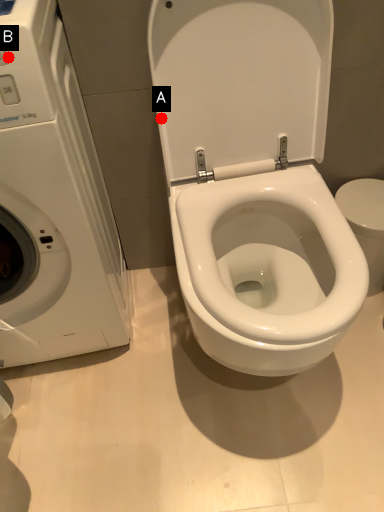
Question: Two points are circled on the image, labeled by A and B beside each circle. Which point appears closest to the camera in this image?

Choices:
 (A) A is closer
 (B) B is closer

Answer: (B)